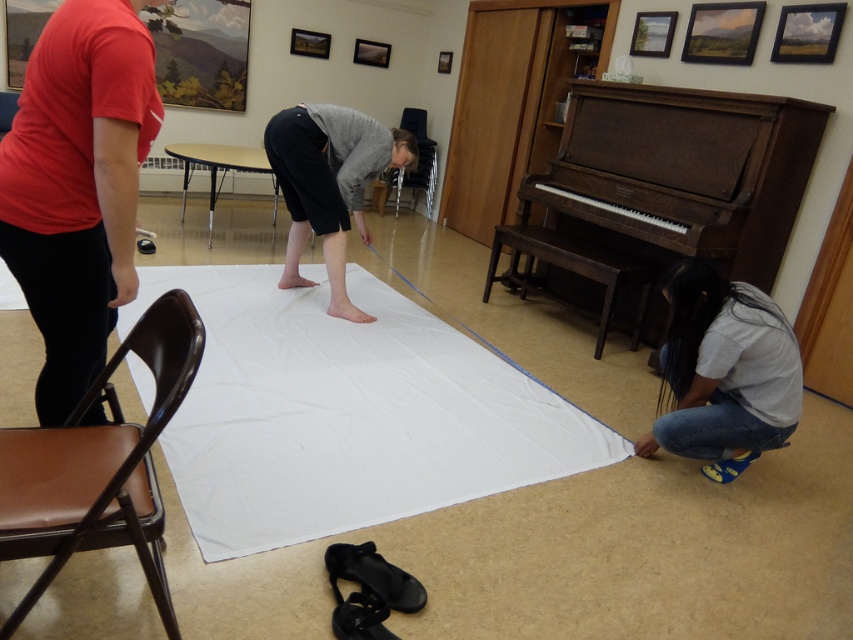
You are standing at the point labeled as point (335, 218) and want to reach the point labeled as point (151, 568). Which direction should you move to get there?

You should move forward because point (151, 568) is in front of point (335, 218).

You are a delivery person who needs to place a package between the gray matte pants at center and the black leather chair at center. The package requires 2 meters of space to fit. Can you fit it between them?

The gray matte pants at center and black leather chair at center are 3.09 meters apart from each other, so yes, the package can be placed between them as the distance is sufficient to accommodate the required 2 meters.